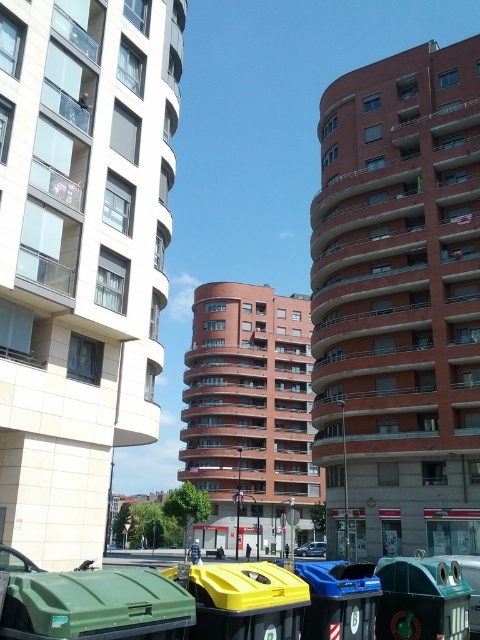
Between yellow plastic bin at lower center and green plastic recycling bin at lower right, which one appears on the right side from the viewer's perspective?

green plastic recycling bin at lower right

Is yellow plastic bin at lower center below green plastic recycling bin at lower right?

Incorrect, yellow plastic bin at lower center is not positioned below green plastic recycling bin at lower right.

This screenshot has width=480, height=640. Identify the location of yellow plastic bin at lower center. (247, 602).

In the scene shown: Is the position of green plastic bin at lower left more distant than that of yellow plastic bin at lower center?

That is False.

Between green plastic bin at lower left and yellow plastic bin at lower center, which one is positioned higher?

yellow plastic bin at lower center

Describe the element at coordinates (96, 605) in the screenshot. I see `green plastic bin at lower left` at that location.

Locate an element on the screen. This screenshot has width=480, height=640. green plastic bin at lower left is located at coordinates (96, 605).

Which is below, green plastic bin at lower left or green plastic recycling bin at lower right?

Positioned lower is green plastic recycling bin at lower right.

How distant is green plastic bin at lower left from green plastic recycling bin at lower right?

The distance of green plastic bin at lower left from green plastic recycling bin at lower right is 4.71 meters.

At what (x,y) coordinates should I click in order to perform the action: click on green plastic bin at lower left. Please return your answer as a coordinate pair (x, y). This screenshot has width=480, height=640. Looking at the image, I should click on (96, 605).